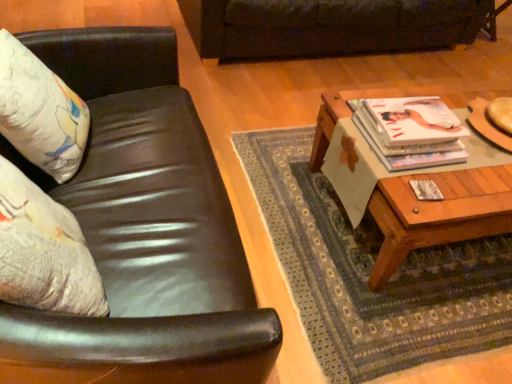
Identify the location of free space on the front side of white glossy magazine at upper right. The width and height of the screenshot is (512, 384). (430, 191).